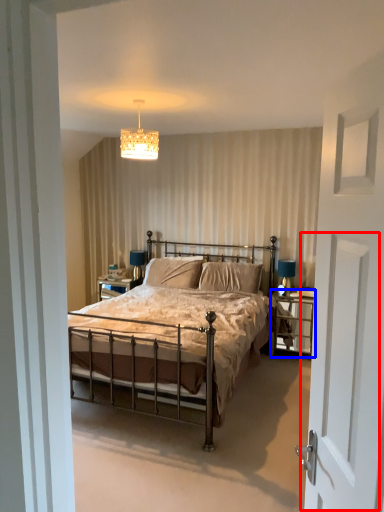
Question: Which point is further to the camera, screen door (highlighted by a red box) or nightstand (highlighted by a blue box)?

Choices:
 (A) screen door
 (B) nightstand

Answer: (B)